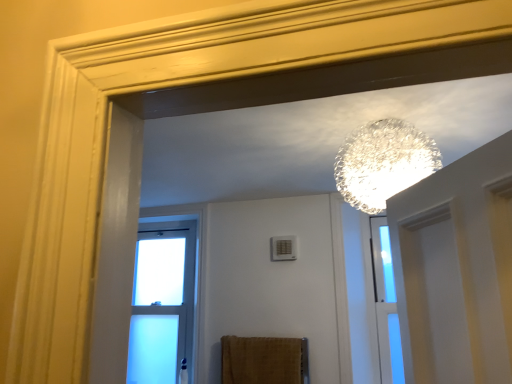
What do you see at coordinates (263, 360) in the screenshot?
I see `brown textured towel at lower center` at bounding box center [263, 360].

Find the location of a particular element. The image size is (512, 384). brown textured towel at lower center is located at coordinates (263, 360).

The height and width of the screenshot is (384, 512). In order to click on clear glass window at center in this screenshot , I will do [x=162, y=303].

You are a GUI agent. You are given a task and a screenshot of the screen. Output one action in this format:
    pyautogui.click(x=<x>, y=<y>)
    Task: Click on the brown textured towel at lower center
    The height and width of the screenshot is (384, 512).
    Given the screenshot: What is the action you would take?
    pyautogui.click(x=263, y=360)

Who is smaller, clear glass sphere at upper center or clear glass window at center?

Smaller between the two is clear glass window at center.

In the image, is clear glass sphere at upper center positioned in front of or behind clear glass window at center?

In the image, clear glass sphere at upper center appears in front of clear glass window at center.

Is clear glass sphere at upper center not inside clear glass window at center?

Yes, clear glass sphere at upper center is not within clear glass window at center.

Does clear glass sphere at upper center turn towards clear glass window at center?

No, clear glass sphere at upper center is not oriented towards clear glass window at center.

Considering the sizes of objects brown textured towel at lower center and clear glass sphere at upper center in the image provided, who is thinner, brown textured towel at lower center or clear glass sphere at upper center?

brown textured towel at lower center.

Is clear glass sphere at upper center a part of brown textured towel at lower center?

No, clear glass sphere at upper center is not inside brown textured towel at lower center.

From a real-world perspective, is brown textured towel at lower center over clear glass sphere at upper center?

No, from a real-world perspective, brown textured towel at lower center is not on top of clear glass sphere at upper center.

Locate an element on the screen. This screenshot has height=384, width=512. lamp above the brown textured towel at lower center (from the image's perspective) is located at coordinates (x=383, y=163).

Is clear glass sphere at upper center completely or partially outside of brown textured towel at lower center?

clear glass sphere at upper center lies outside brown textured towel at lower center's area.

Considering the sizes of clear glass sphere at upper center and brown textured towel at lower center in the image, is clear glass sphere at upper center bigger or smaller than brown textured towel at lower center?

Considering their sizes, clear glass sphere at upper center takes up more space than brown textured towel at lower center.

Does point (381, 134) come behind point (234, 348)?

No, it is in front of (234, 348).

Would you say brown textured towel at lower center contains clear glass window at center?

No, clear glass window at center is located outside of brown textured towel at lower center.

Is brown textured towel at lower center positioned behind clear glass window at center?

No, the depth of brown textured towel at lower center is less than that of clear glass window at center.

From the image's perspective, which is below, brown textured towel at lower center or clear glass window at center?

brown textured towel at lower center.

Who is bigger, brown textured towel at lower center or clear glass window at center?

clear glass window at center is bigger.

Is clear glass window at center looking in the opposite direction of brown textured towel at lower center?

clear glass window at center is not turned away from brown textured towel at lower center.

From the image's perspective, which is above, clear glass window at center or brown textured towel at lower center?

clear glass window at center, from the image's perspective.

Considering the relative positions of clear glass window at center and brown textured towel at lower center in the image provided, is clear glass window at center behind brown textured towel at lower center?

Yes, the depth of clear glass window at center is greater than that of brown textured towel at lower center.

Considering the relative sizes of clear glass window at center and brown textured towel at lower center in the image provided, is clear glass window at center shorter than brown textured towel at lower center?

No, clear glass window at center is not shorter than brown textured towel at lower center.

From a real-world perspective, is clear glass window at center under clear glass sphere at upper center?

Indeed, from a real-world perspective, clear glass window at center is positioned beneath clear glass sphere at upper center.

Which of these two, clear glass window at center or clear glass sphere at upper center, stands taller?

With more height is clear glass window at center.

Is clear glass window at center smaller than clear glass sphere at upper center?

Yes.

Does clear glass window at center touch clear glass sphere at upper center?

clear glass window at center and clear glass sphere at upper center are not in contact.

I want to click on lamp that appears on the right of clear glass window at center, so click(x=383, y=163).

You are a GUI agent. You are given a task and a screenshot of the screen. Output one action in this format:
    pyautogui.click(x=<x>, y=<y>)
    Task: Click on the lamp above the brown textured towel at lower center (from the image's perspective)
    The image size is (512, 384).
    Given the screenshot: What is the action you would take?
    pyautogui.click(x=383, y=163)

Which object lies further to the anchor point brown textured towel at lower center, clear glass sphere at upper center or clear glass window at center?

Among the two, clear glass sphere at upper center is located further to brown textured towel at lower center.

Based on their spatial positions, is clear glass sphere at upper center or brown textured towel at lower center further from clear glass window at center?

Based on the image, clear glass sphere at upper center appears to be further to clear glass window at center.

Looking at the image, which one is located further to clear glass sphere at upper center, brown textured towel at lower center or clear glass window at center?

Among the two, clear glass window at center is located further to clear glass sphere at upper center.

Based on their spatial positions, is clear glass window at center or brown textured towel at lower center further from clear glass sphere at upper center?

clear glass window at center is positioned further to the anchor clear glass sphere at upper center.

Based on their spatial positions, is brown textured towel at lower center or clear glass sphere at upper center closer to clear glass window at center?

brown textured towel at lower center lies closer to clear glass window at center than the other object.

Considering their positions, is clear glass window at center positioned further to brown textured towel at lower center than clear glass sphere at upper center?

The object further to brown textured towel at lower center is clear glass sphere at upper center.

At what (x,y) coordinates should I click in order to perform the action: click on bath towel positioned between clear glass sphere at upper center and clear glass window at center from near to far. Please return your answer as a coordinate pair (x, y). This screenshot has height=384, width=512. Looking at the image, I should click on (263, 360).